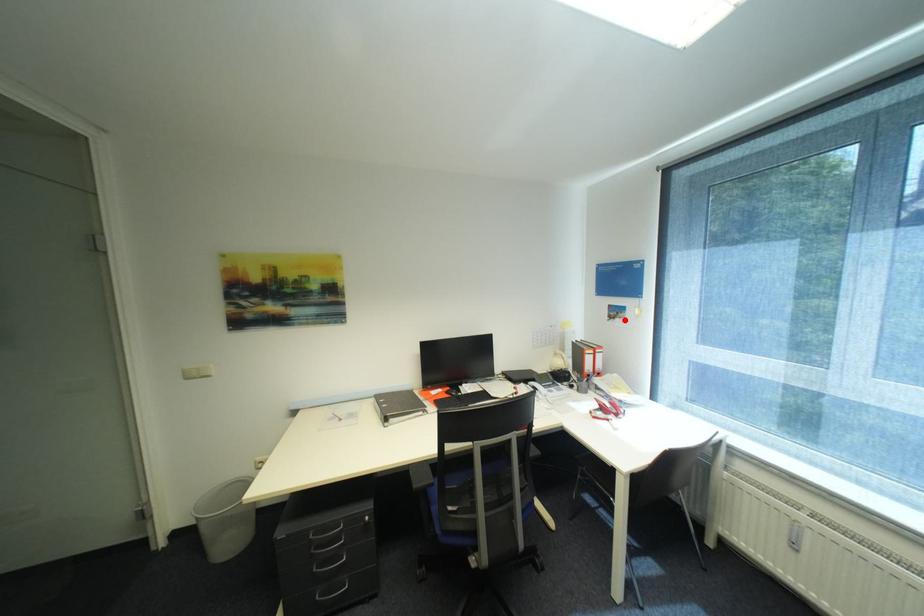
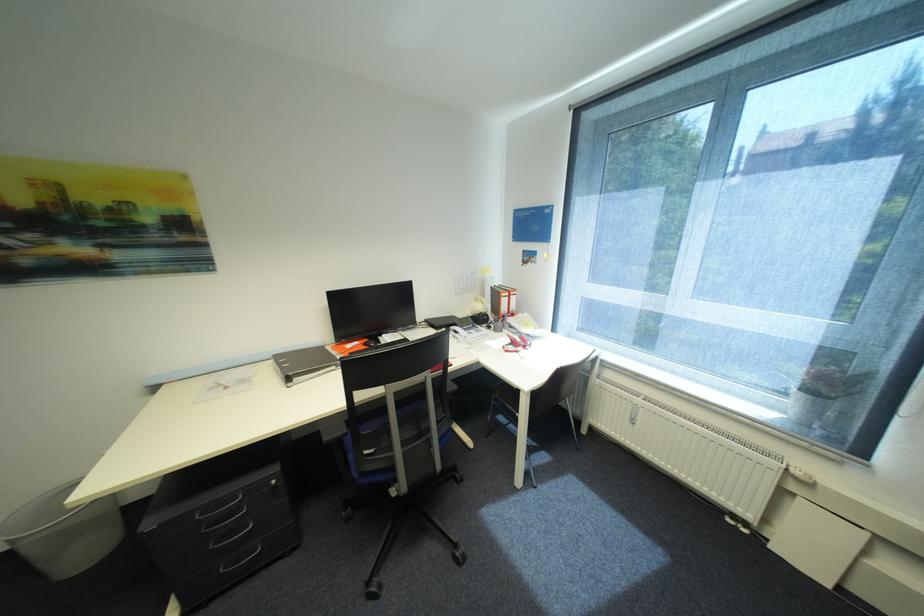
Find the pixel in the second image that matches the highlighted location in the first image.

(537, 265)